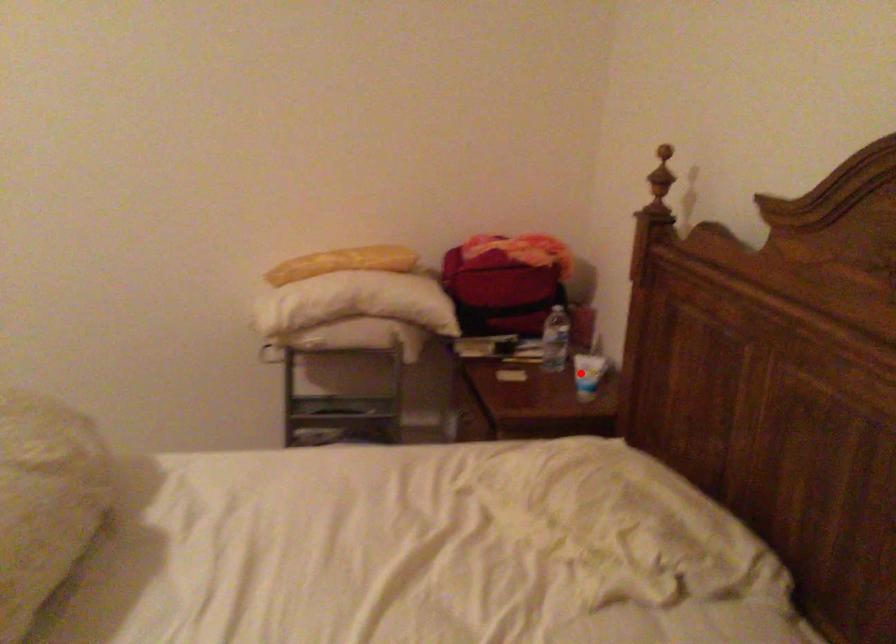
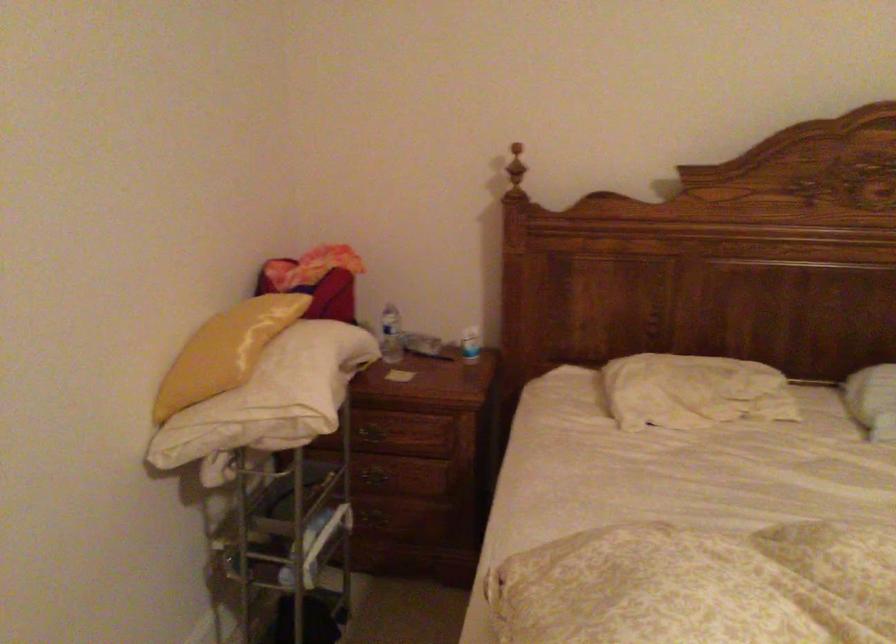
Where in the second image is the point corresponding to the highlighted location from the first image?

(470, 344)